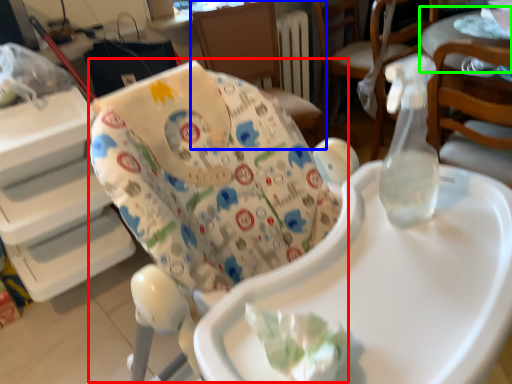
Question: Based on their relative distances, which object is nearer to rocking chair (highlighted by a red box)? Choose from chair (highlighted by a blue box) and table (highlighted by a green box).

Choices:
 (A) chair
 (B) table

Answer: (B)